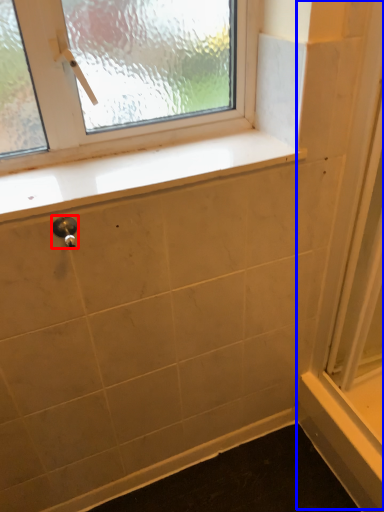
Question: Which object appears closest to the camera in this image, door handle (highlighted by a red box) or screen door (highlighted by a blue box)?

Choices:
 (A) door handle
 (B) screen door

Answer: (B)